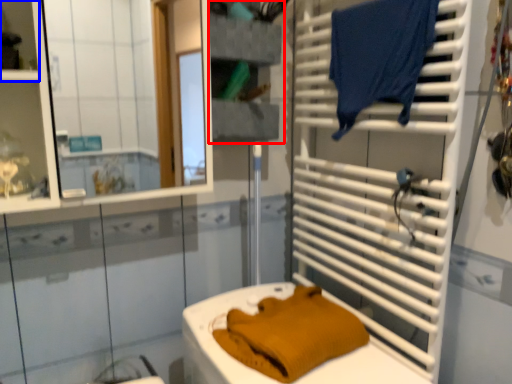
Question: Which object appears farthest to the camera in this image, shelf (highlighted by a red box) or shelf (highlighted by a blue box)?

Choices:
 (A) shelf
 (B) shelf

Answer: (A)